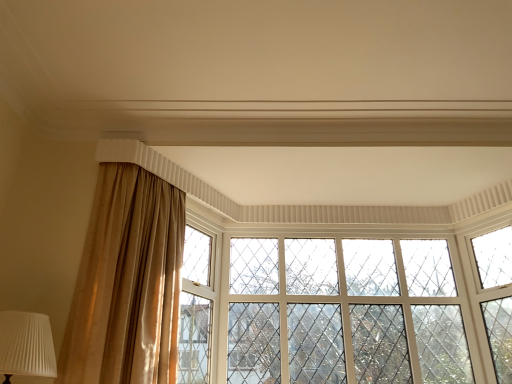
What do you see at coordinates (197, 306) in the screenshot? I see `white textured glass window frame at center` at bounding box center [197, 306].

Locate an element on the screen. The image size is (512, 384). white textured glass window frame at center is located at coordinates (197, 306).

Locate an element on the screen. This screenshot has width=512, height=384. clear glass window at center is located at coordinates (346, 309).

Find the location of a particular element. Image resolution: width=512 pixels, height=384 pixels. satin beige curtain at left is located at coordinates (127, 283).

Locate an element on the screen. This screenshot has width=512, height=384. white textured glass window frame at center is located at coordinates (197, 306).

Is clear glass window at center not near white textured glass window frame at center?

clear glass window at center is near white textured glass window frame at center, not far away.

Is clear glass window at center completely or partially outside of white textured glass window frame at center?

Absolutely, clear glass window at center is external to white textured glass window frame at center.

Does clear glass window at center have a greater height compared to white textured glass window frame at center?

No.

From the image's perspective, does white textured glass window frame at center appear lower than white pleated fabric at lower left?

Indeed, from the image's perspective, white textured glass window frame at center is shown beneath white pleated fabric at lower left.

Can you tell me how much white textured glass window frame at center and white pleated fabric at lower left differ in facing direction?

They differ by 3.25 degrees in their facing directions.

Can you confirm if white textured glass window frame at center is wider than white pleated fabric at lower left?

No, white textured glass window frame at center is not wider than white pleated fabric at lower left.

In the scene shown: Is white textured glass window frame at center to the right of white pleated fabric at lower left from the viewer's perspective?

Indeed, white textured glass window frame at center is positioned on the right side of white pleated fabric at lower left.

Considering the points (160, 213) and (41, 359), which point is behind, point (160, 213) or point (41, 359)?

The point (160, 213) is farther from the camera.

Is satin beige curtain at left beside white pleated fabric at lower left?

satin beige curtain at left and white pleated fabric at lower left are not in contact.

From a real-world perspective, is satin beige curtain at left under white pleated fabric at lower left?

No.

Considering the relative positions of satin beige curtain at left and white pleated fabric at lower left in the image provided, is satin beige curtain at left behind white pleated fabric at lower left?

Yes, satin beige curtain at left is further from the camera.

From a real-world perspective, is clear glass window at center on top of satin beige curtain at left?

Correct, in the physical world, clear glass window at center is higher than satin beige curtain at left.

Who is taller, clear glass window at center or satin beige curtain at left?

clear glass window at center.

This screenshot has width=512, height=384. Find the location of `window located below the satin beige curtain at left (from the image's perspective)`. window located below the satin beige curtain at left (from the image's perspective) is located at coordinates (346, 309).

Based on their positions, is satin beige curtain at left located to the left or right of clear glass window at center?

Clearly, satin beige curtain at left is on the left of clear glass window at center in the image.

Can you tell me how much satin beige curtain at left and clear glass window at center differ in facing direction?

60.1 degrees separate the facing orientations of satin beige curtain at left and clear glass window at center.

Is satin beige curtain at left facing towards clear glass window at center?

No.

Can you tell me how much clear glass window at center and white pleated fabric at lower left differ in facing direction?

There is a 55.6-degree angle between the facing directions of clear glass window at center and white pleated fabric at lower left.

Are clear glass window at center and white pleated fabric at lower left making contact?

They are not placed beside each other.

Between clear glass window at center and white pleated fabric at lower left, which one appears on the right side from the viewer's perspective?

From the viewer's perspective, clear glass window at center appears more on the right side.

From the image's perspective, which object appears higher, clear glass window at center or white pleated fabric at lower left?

white pleated fabric at lower left is shown above in the image.

Is white pleated fabric at lower left further to the viewer compared to clear glass window at center?

No, white pleated fabric at lower left is closer to the camera.

Is point (20, 330) positioned after point (463, 349)?

No, it is not.

Looking at their sizes, would you say white pleated fabric at lower left is wider or thinner than clear glass window at center?

In the image, white pleated fabric at lower left appears to be wider than clear glass window at center.

Where is `window located behind the white pleated fabric at lower left`? The height and width of the screenshot is (384, 512). window located behind the white pleated fabric at lower left is located at coordinates (346, 309).

Where is `window below the white textured glass window frame at center (from the image's perspective)`? The image size is (512, 384). window below the white textured glass window frame at center (from the image's perspective) is located at coordinates (346, 309).

The width and height of the screenshot is (512, 384). Find the location of `window frame that appears above the white pleated fabric at lower left (from a real-world perspective)`. window frame that appears above the white pleated fabric at lower left (from a real-world perspective) is located at coordinates (197, 306).

Based on their spatial positions, is clear glass window at center or white textured glass window frame at center closer to white pleated fabric at lower left?

white textured glass window frame at center lies closer to white pleated fabric at lower left than the other object.

From the picture: Considering their positions, is white pleated fabric at lower left positioned further to clear glass window at center than satin beige curtain at left?

white pleated fabric at lower left.

When comparing their distances from white textured glass window frame at center, does white pleated fabric at lower left or clear glass window at center seem closer?

clear glass window at center is positioned closer to the anchor white textured glass window frame at center.

Based on their spatial positions, is clear glass window at center or white pleated fabric at lower left closer to white textured glass window frame at center?

clear glass window at center is closer to white textured glass window frame at center.

Considering their positions, is satin beige curtain at left positioned closer to white textured glass window frame at center than white pleated fabric at lower left?

Based on the image, satin beige curtain at left appears to be nearer to white textured glass window frame at center.

Estimate the real-world distances between objects in this image. Which object is closer to satin beige curtain at left, white textured glass window frame at center or clear glass window at center?

Among the two, white textured glass window frame at center is located nearer to satin beige curtain at left.

When comparing their distances from white pleated fabric at lower left, does satin beige curtain at left or white textured glass window frame at center seem closer?

Among the two, satin beige curtain at left is located nearer to white pleated fabric at lower left.

Based on their spatial positions, is clear glass window at center or white pleated fabric at lower left closer to satin beige curtain at left?

Among the two, white pleated fabric at lower left is located nearer to satin beige curtain at left.

You are a GUI agent. You are given a task and a screenshot of the screen. Output one action in this format:
    pyautogui.click(x=<x>, y=<y>)
    Task: Click on the curtain between white pleated fabric at lower left and white textured glass window frame at center along the z-axis
    This screenshot has width=512, height=384.
    Given the screenshot: What is the action you would take?
    pyautogui.click(x=127, y=283)

This screenshot has width=512, height=384. I want to click on window frame between white pleated fabric at lower left and clear glass window at center in the horizontal direction, so 197,306.

The height and width of the screenshot is (384, 512). Find the location of `curtain located between white pleated fabric at lower left and clear glass window at center in the left-right direction`. curtain located between white pleated fabric at lower left and clear glass window at center in the left-right direction is located at coordinates (127, 283).

This screenshot has width=512, height=384. I want to click on window frame between satin beige curtain at left and clear glass window at center in the horizontal direction, so click(x=197, y=306).